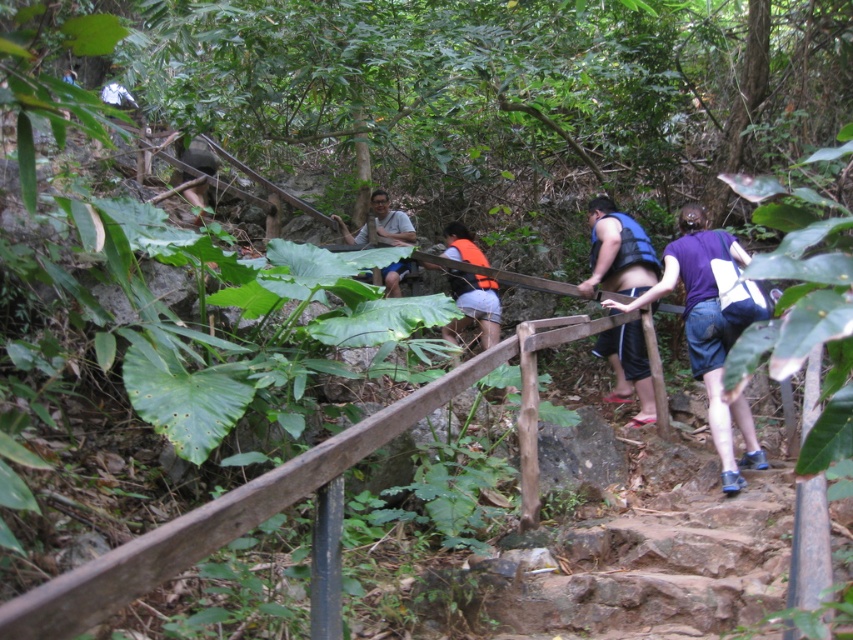
Question: Does brown wooden rail at center come in front of blue fabric shorts at center?

Choices:
 (A) no
 (B) yes

Answer: (B)

Question: Which point is closer to the camera?

Choices:
 (A) matte gray shirt at center
 (B) brown wooden rail at center
 (C) orange life vest at center
 (D) blue fabric shorts at center

Answer: (B)

Question: Does brown wooden rail at center have a larger size compared to matte gray shirt at center?

Choices:
 (A) yes
 (B) no

Answer: (A)

Question: Which point is closer to the camera?

Choices:
 (A) (634, 348)
 (B) (532, 502)

Answer: (B)

Question: Which point is closer to the camera taking this photo?

Choices:
 (A) (399, 211)
 (B) (590, 262)

Answer: (B)

Question: Does blue life vest at center have a greater width compared to orange life vest at center?

Choices:
 (A) no
 (B) yes

Answer: (A)